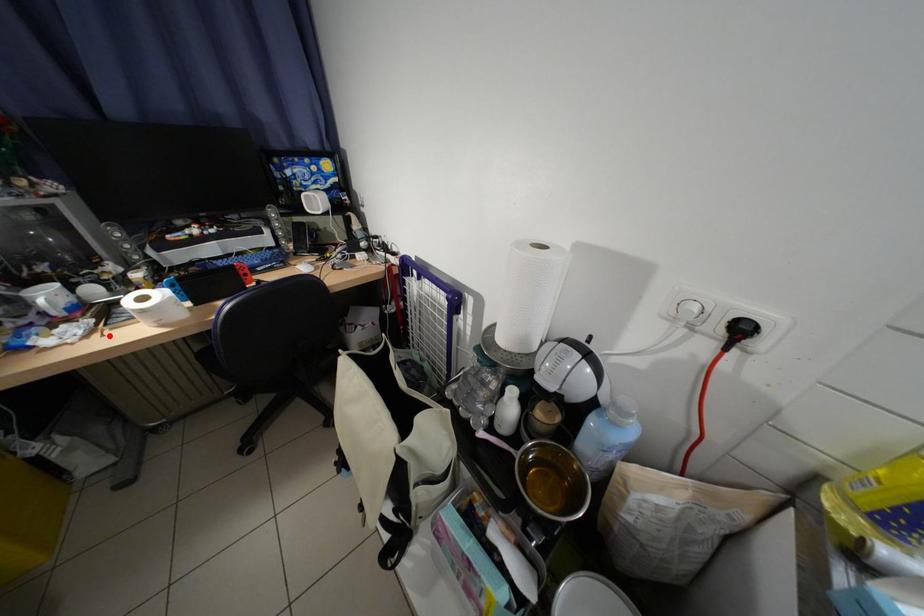
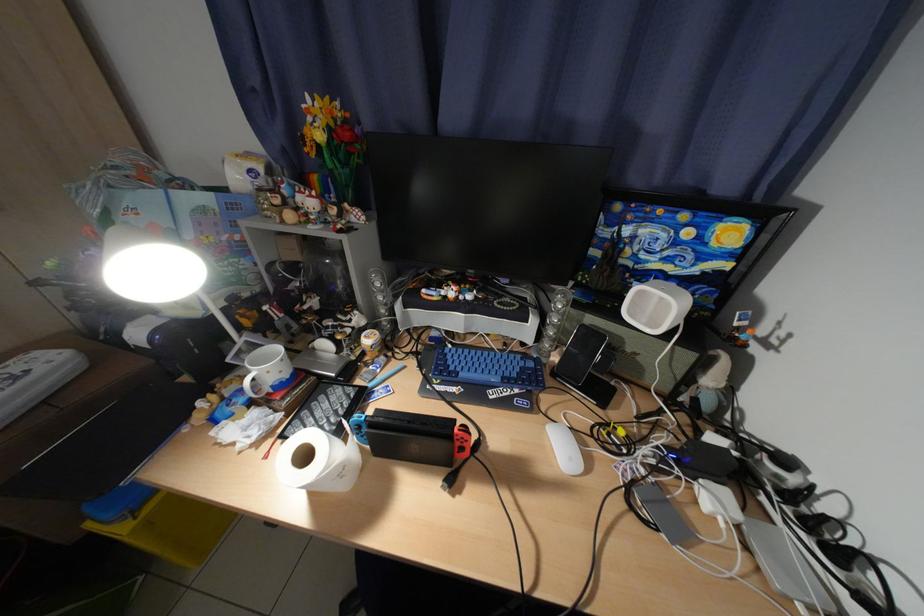
In the second image, find the point that corresponds to the highlighted location in the first image.

(282, 444)